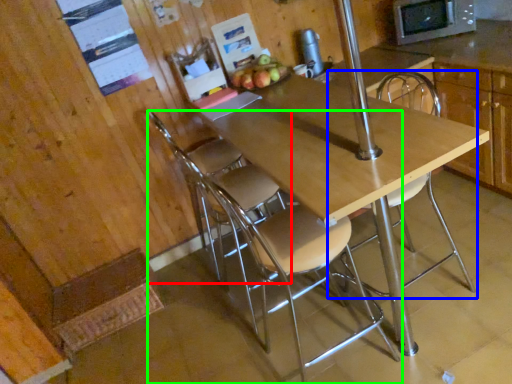
Question: Considering the real-world distances, which object is farthest from chair (highlighted by a red box)? chair (highlighted by a blue box) or chair (highlighted by a green box)?

Choices:
 (A) chair
 (B) chair

Answer: (A)